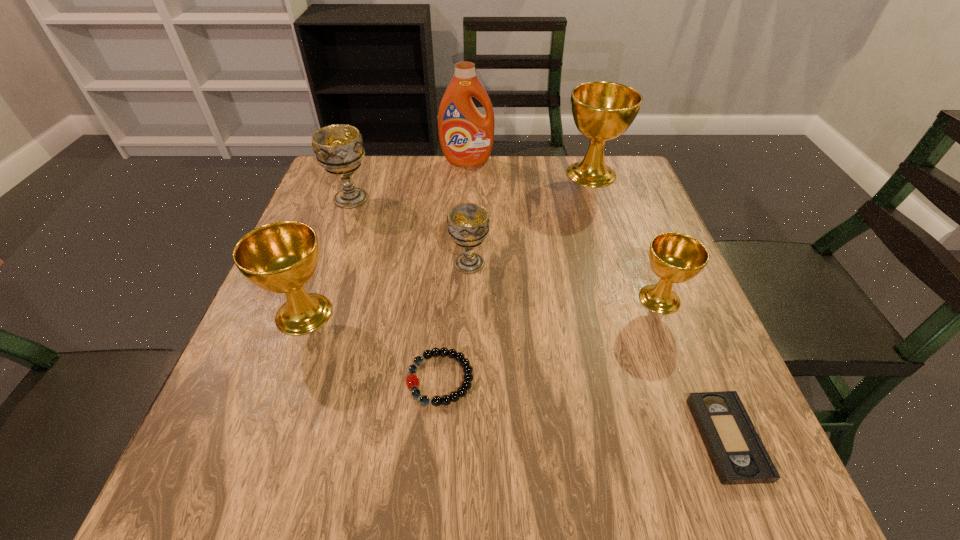
Find the location of `detergent`. detergent is located at coordinates click(x=466, y=136).

Image resolution: width=960 pixels, height=540 pixels. In order to click on the tallest chalice in this screenshot , I will do `click(602, 111)`.

Find the location of a particular element. This screenshot has width=960, height=540. the biggest gold chalice is located at coordinates click(x=602, y=111).

Where is `the bigger white chalice`? the bigger white chalice is located at coordinates (338, 148).

At what (x,y) coordinates should I click in order to perform the action: click on the farther white chalice. Please return your answer as a coordinate pair (x, y). The width and height of the screenshot is (960, 540). Looking at the image, I should click on (338, 148).

Where is `the second smallest gold chalice`? The image size is (960, 540). the second smallest gold chalice is located at coordinates [x=281, y=257].

Where is `the right white chalice`? the right white chalice is located at coordinates (468, 223).

I want to click on the nearer white chalice, so click(x=468, y=223).

Where is `the smallest gold chalice`? Image resolution: width=960 pixels, height=540 pixels. the smallest gold chalice is located at coordinates (674, 257).

This screenshot has width=960, height=540. In order to click on bracelet in this screenshot , I will do `click(412, 380)`.